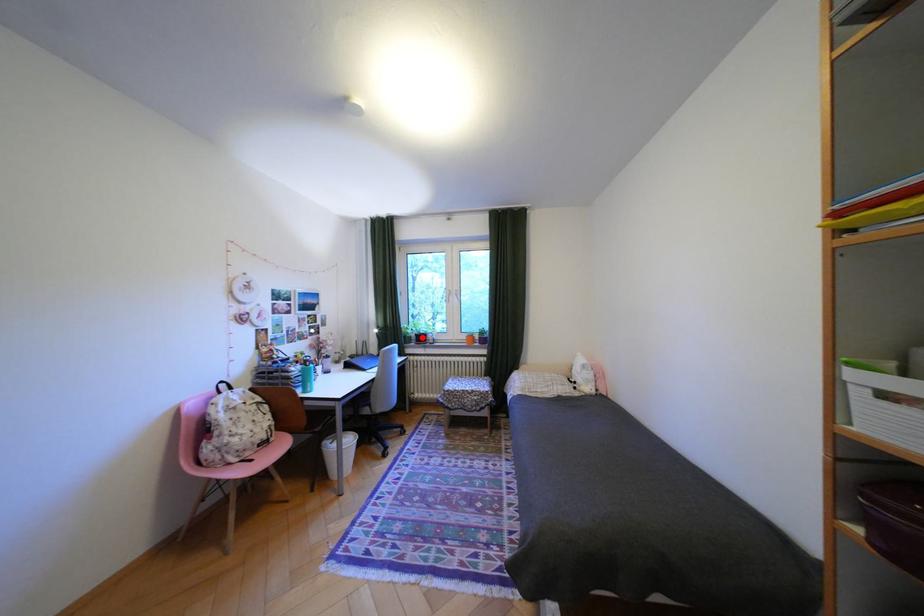
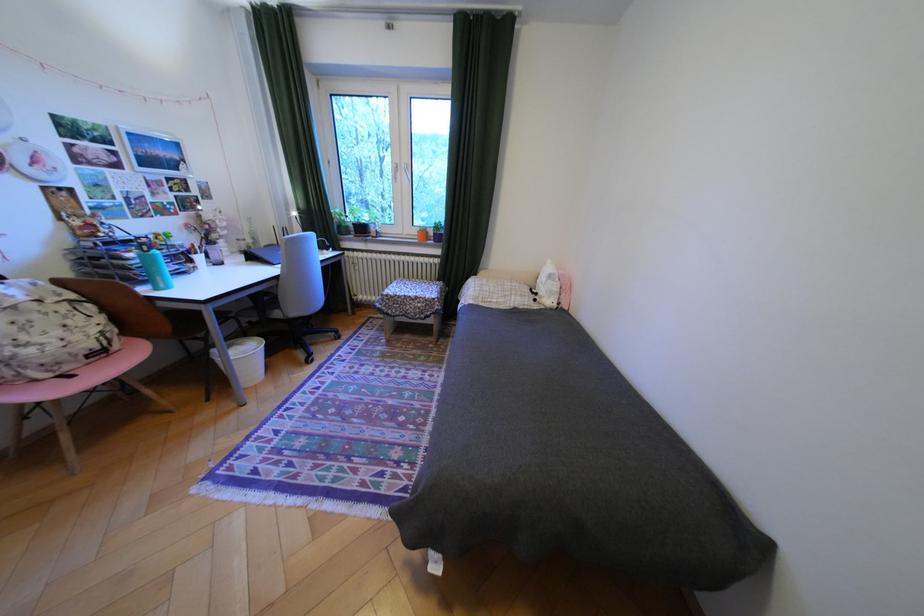
Find the pixel in the second image that matches the highlighted location in the first image.

(359, 227)